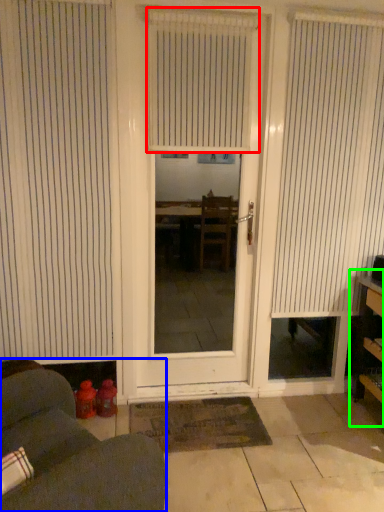
Question: Considering the real-world distances, which object is closest to window blind (highlighted by a red box)? furniture (highlighted by a blue box) or bookshelf (highlighted by a green box).

Choices:
 (A) furniture
 (B) bookshelf

Answer: (B)